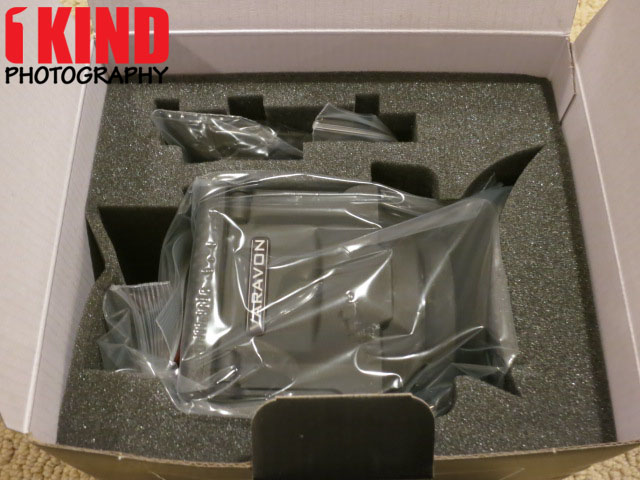
This screenshot has width=640, height=480. Identify the location of foam. (470, 136), (492, 423), (128, 421), (153, 147).